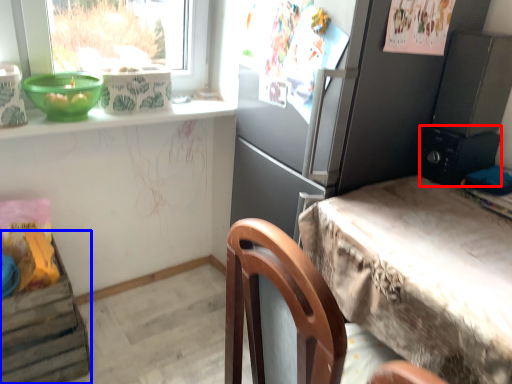
Question: Among these objects, which one is farthest to the camera, appliance (highlighted by a red box) or shelf (highlighted by a blue box)?

Choices:
 (A) appliance
 (B) shelf

Answer: (A)